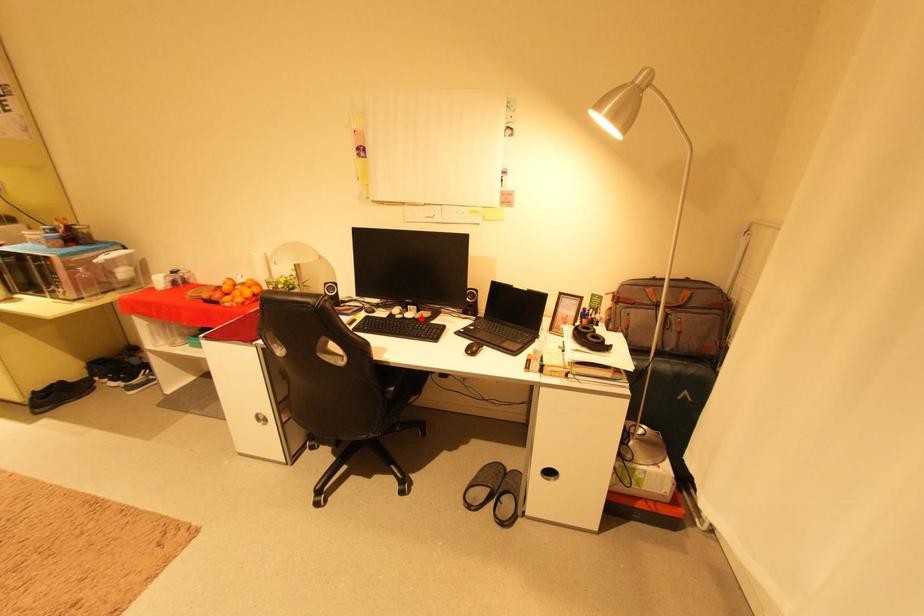
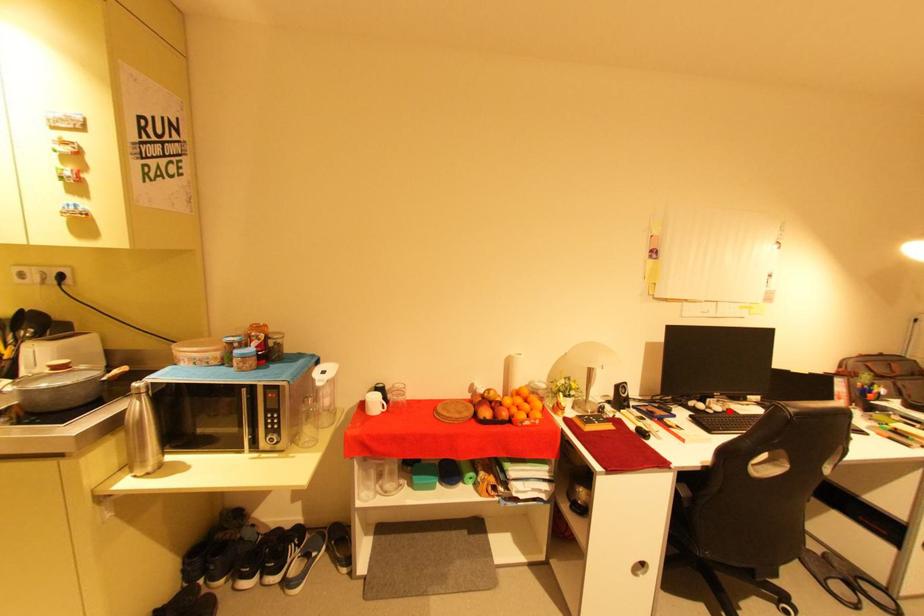
I am providing you with two images of the same scene from different viewpoints. A red point is marked on the first image and another point is marked on the second image. Does the point marked in image1 correspond to the same location as the one in image2?

Yes